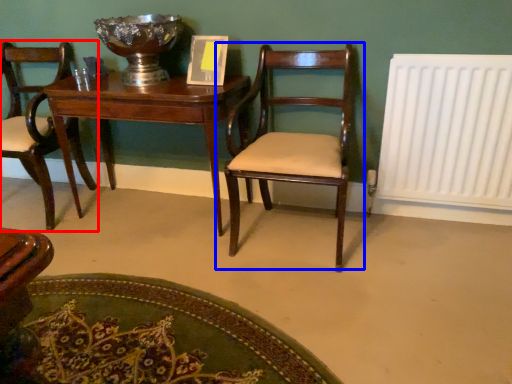
Question: Which object appears farthest to the camera in this image, chair (highlighted by a red box) or chair (highlighted by a blue box)?

Choices:
 (A) chair
 (B) chair

Answer: (A)